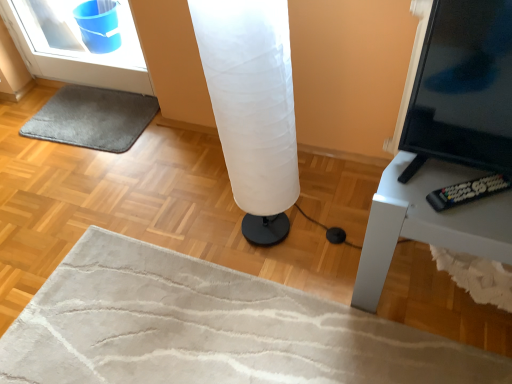
Question: Visually, is gray soft rug at lower left positioned to the left or to the right of black glossy screen at right?

Choices:
 (A) right
 (B) left

Answer: (B)

Question: From a real-world perspective, relative to black glossy screen at right, is gray soft rug at lower left vertically above or below?

Choices:
 (A) above
 (B) below

Answer: (B)

Question: Which object is the farthest from the gray soft rug at lower left?

Choices:
 (A) black plastic tv stand at right
 (B) white fabric lamp at center
 (C) black glossy screen at right

Answer: (C)

Question: Which is nearer to the gray soft rug at lower left?

Choices:
 (A) black plastic tv stand at right
 (B) white fabric lamp at center
 (C) black glossy screen at right

Answer: (B)